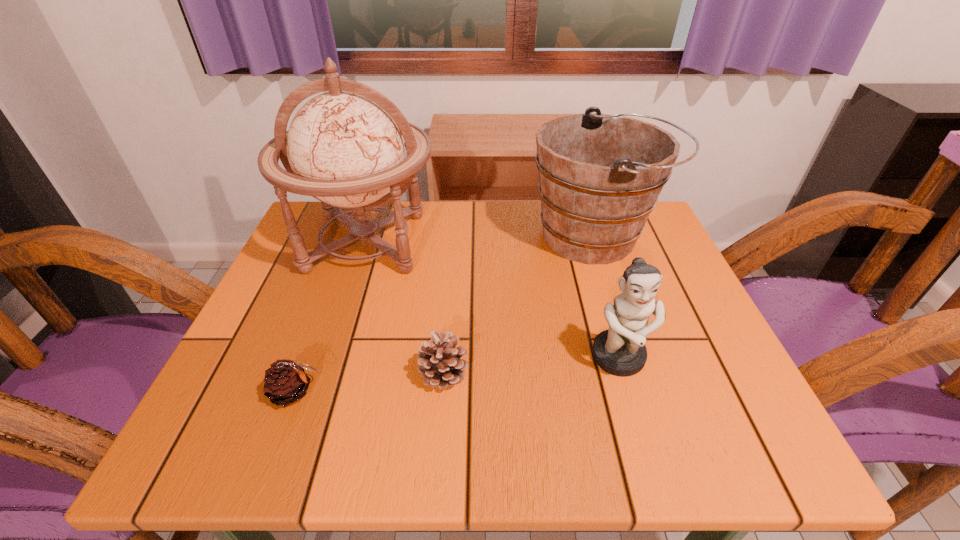
Identify the location of globe. click(x=344, y=147).

You are a GUI agent. You are given a task and a screenshot of the screen. Output one action in this format:
    pyautogui.click(x=<x>, y=<y>)
    Task: Click on the fourth shortest object
    The image size is (960, 540).
    Given the screenshot: What is the action you would take?
    pyautogui.click(x=600, y=175)

Find the location of a particular element. The width and height of the screenshot is (960, 540). the third shortest object is located at coordinates (620, 351).

Image resolution: width=960 pixels, height=540 pixels. In order to click on the right pinecone in this screenshot , I will do `click(439, 362)`.

Find the location of a particular element. The width and height of the screenshot is (960, 540). the fourth tallest object is located at coordinates (439, 362).

Identify the location of the shorter pinecone. (285, 381).

At what (x,y) coordinates should I click in order to perform the action: click on the left pinecone. Please return your answer as a coordinate pair (x, y). The width and height of the screenshot is (960, 540). Looking at the image, I should click on (285, 381).

Find the location of a particular element. The image size is (960, 540). free space located on the front-facing side of the tallest object is located at coordinates (340, 321).

This screenshot has height=540, width=960. What are the coordinates of `vacant space located 0.060m on the front-facing side of the figurine` in the screenshot? It's located at (636, 416).

Image resolution: width=960 pixels, height=540 pixels. Find the location of `free space located on the left of the second shortest object`. free space located on the left of the second shortest object is located at coordinates pos(250,373).